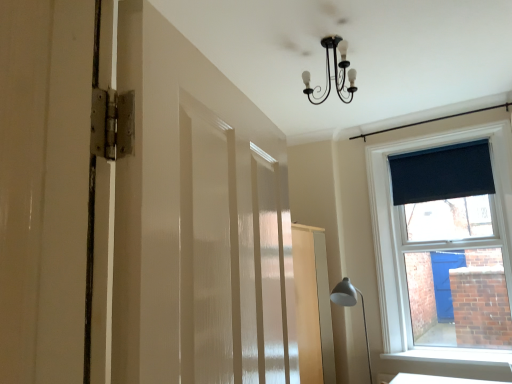
Question: Does white glossy table at lower right appear on the right side of matte silver lamp at lower right?

Choices:
 (A) no
 (B) yes

Answer: (B)

Question: From a real-world perspective, is white glossy table at lower right beneath matte silver lamp at lower right?

Choices:
 (A) yes
 (B) no

Answer: (A)

Question: Would you consider white glossy table at lower right to be distant from matte silver lamp at lower right?

Choices:
 (A) no
 (B) yes

Answer: (A)

Question: Does white glossy table at lower right have a greater height compared to matte silver lamp at lower right?

Choices:
 (A) no
 (B) yes

Answer: (A)

Question: Is white glossy table at lower right facing away from matte silver lamp at lower right?

Choices:
 (A) yes
 (B) no

Answer: (B)

Question: Is white glossy table at lower right positioned in front of matte silver lamp at lower right?

Choices:
 (A) yes
 (B) no

Answer: (B)

Question: Can you confirm if dark blue fabric at upper right is bigger than white textured barn door at left?

Choices:
 (A) yes
 (B) no

Answer: (B)

Question: Considering the relative sizes of dark blue fabric at upper right and white textured barn door at left in the image provided, is dark blue fabric at upper right shorter than white textured barn door at left?

Choices:
 (A) yes
 (B) no

Answer: (A)

Question: From a real-world perspective, is dark blue fabric at upper right under white textured barn door at left?

Choices:
 (A) no
 (B) yes

Answer: (A)

Question: Does dark blue fabric at upper right turn towards white textured barn door at left?

Choices:
 (A) no
 (B) yes

Answer: (B)

Question: From a real-world perspective, is dark blue fabric at upper right located higher than white textured barn door at left?

Choices:
 (A) yes
 (B) no

Answer: (A)

Question: Does dark blue fabric at upper right have a greater width compared to white textured barn door at left?

Choices:
 (A) no
 (B) yes

Answer: (A)

Question: From a real-world perspective, does dark blue fabric at upper right sit lower than matte silver lamp at lower right?

Choices:
 (A) no
 (B) yes

Answer: (A)